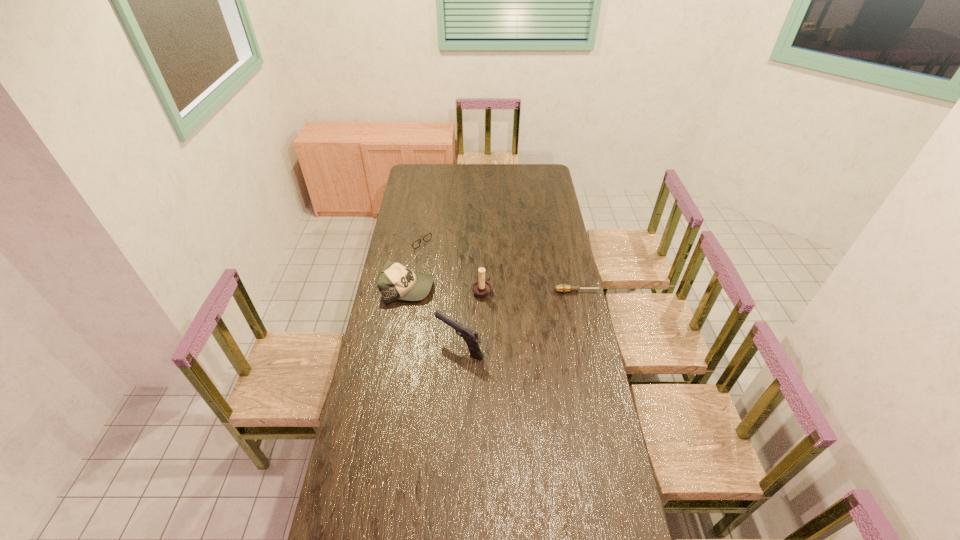
Locate an element on the screen. This screenshot has height=540, width=960. blank space located 0.330m on the front-facing side of the third shortest object is located at coordinates (500, 305).

Identify the location of vacant point located 0.110m on the front-facing side of the third shortest object. (455, 296).

Where is `vacant region located 0.280m on the front-facing side of the third shortest object`? This screenshot has height=540, width=960. vacant region located 0.280m on the front-facing side of the third shortest object is located at coordinates (490, 303).

Find the location of a particular element. The width and height of the screenshot is (960, 540). blank space located on the front-facing side of the fourth tallest object is located at coordinates (453, 266).

Where is `vacant region located 0.210m on the front-facing side of the fourth tallest object`? The image size is (960, 540). vacant region located 0.210m on the front-facing side of the fourth tallest object is located at coordinates (453, 266).

Where is `vacant space located on the front-facing side of the fourth tallest object`? vacant space located on the front-facing side of the fourth tallest object is located at coordinates (460, 270).

The height and width of the screenshot is (540, 960). What are the coordinates of `vacant area situated 0.250m on the wick of the candle holder` in the screenshot? It's located at (540, 314).

At what (x,y) coordinates should I click in order to perform the action: click on free location located 0.350m on the wick of the candle holder. Please return your answer as a coordinate pair (x, y). The width and height of the screenshot is (960, 540). Looking at the image, I should click on (560, 323).

I want to click on vacant space located on the wick of the candle holder, so click(500, 299).

Image resolution: width=960 pixels, height=540 pixels. I want to click on baseball cap present at the left edge, so click(396, 281).